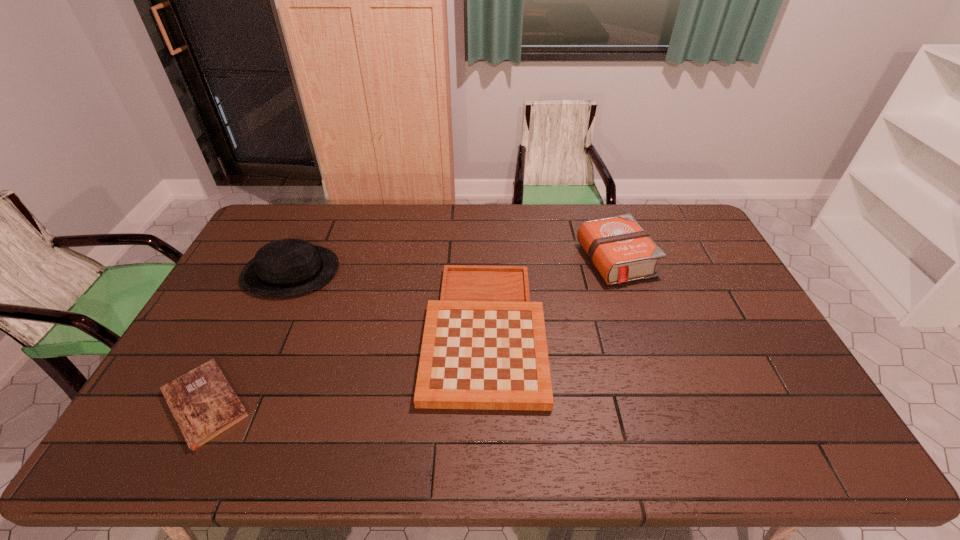
Locate an element on the screen. The height and width of the screenshot is (540, 960). vacant space at the near right corner of the desktop is located at coordinates (787, 461).

Where is `vacant area that lies between the left Bible and the third tallest object`? This screenshot has height=540, width=960. vacant area that lies between the left Bible and the third tallest object is located at coordinates (345, 367).

Identify the location of free space between the third tallest object and the fedora. (388, 301).

The width and height of the screenshot is (960, 540). Find the location of `empty location between the farther Bible and the third tallest object`. empty location between the farther Bible and the third tallest object is located at coordinates (550, 295).

Identify the location of free area in between the left Bible and the gameboard. This screenshot has height=540, width=960. (345, 367).

The image size is (960, 540). I want to click on unoccupied area between the third tallest object and the nearer Bible, so click(345, 367).

The height and width of the screenshot is (540, 960). Find the location of `free space between the nearer Bible and the fedora`. free space between the nearer Bible and the fedora is located at coordinates [x=248, y=338].

The width and height of the screenshot is (960, 540). Find the location of `free space between the nearer Bible and the taller Bible`. free space between the nearer Bible and the taller Bible is located at coordinates (410, 332).

At what (x,y) coordinates should I click in order to perform the action: click on free space between the left Bible and the fedora. Please return your answer as a coordinate pair (x, y). This screenshot has width=960, height=540. Looking at the image, I should click on (248, 338).

This screenshot has height=540, width=960. Find the location of `blank region between the third tallest object and the taller Bible`. blank region between the third tallest object and the taller Bible is located at coordinates (550, 295).